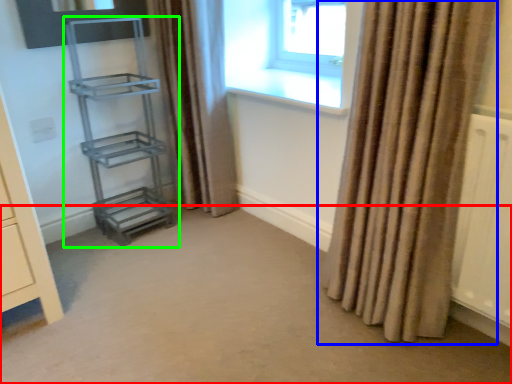
Question: Which is farther away from plain (highlighted by a red box)? curtain (highlighted by a blue box) or shelf (highlighted by a green box)?

Choices:
 (A) curtain
 (B) shelf

Answer: (B)